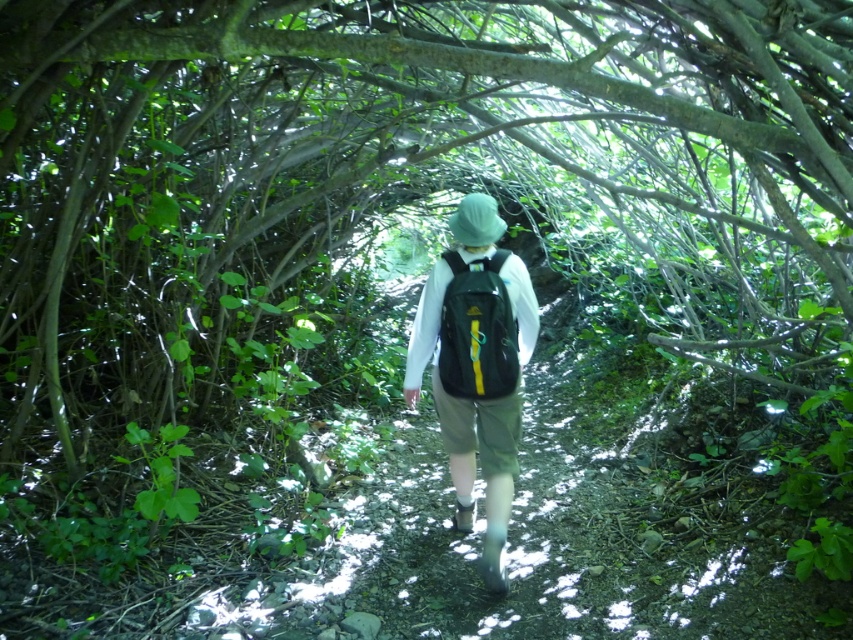
Question: Can you confirm if matte black backpack at center is positioned to the right of matte green backpack at center?

Choices:
 (A) no
 (B) yes

Answer: (B)

Question: Is matte black backpack at center wider than matte green backpack at center?

Choices:
 (A) yes
 (B) no

Answer: (A)

Question: Which point is farther from the camera taking this photo?

Choices:
 (A) (454, 467)
 (B) (492, 308)

Answer: (A)

Question: Among these points, which one is farthest from the camera?

Choices:
 (A) (445, 346)
 (B) (445, 280)

Answer: (B)

Question: Among these points, which one is nearest to the camera?

Choices:
 (A) tap(405, 372)
 (B) tap(448, 282)

Answer: (B)

Question: Considering the relative positions of matte black backpack at center and matte green backpack at center in the image provided, where is matte black backpack at center located with respect to matte green backpack at center?

Choices:
 (A) above
 (B) below

Answer: (B)